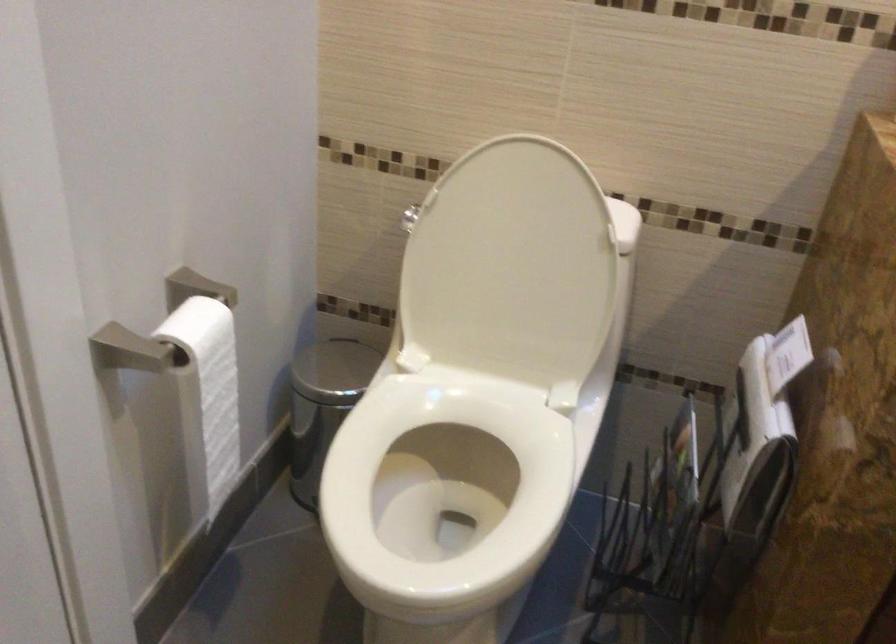
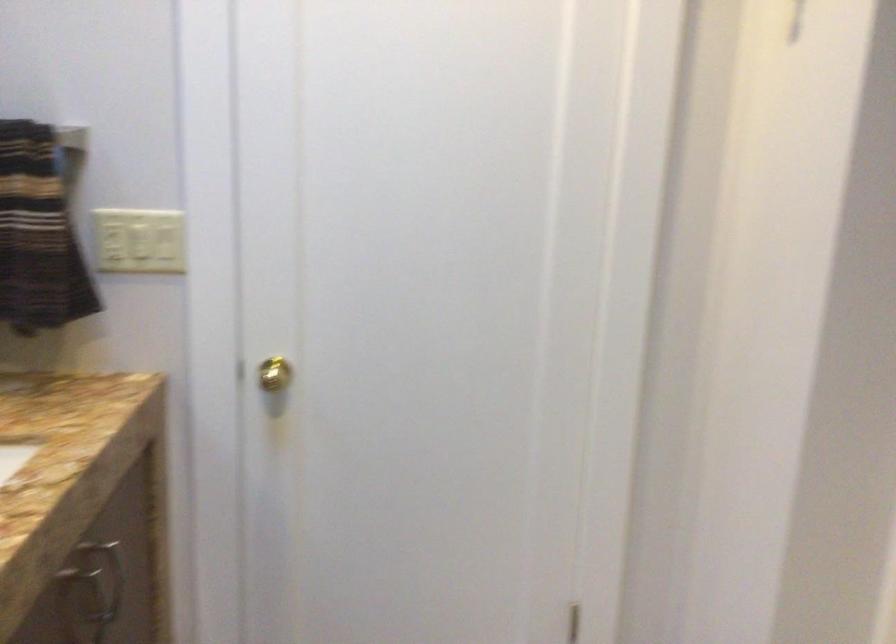
In the scene shown: First-person continuous shooting, in which direction is the camera rotating?

The camera rotated toward right-down.